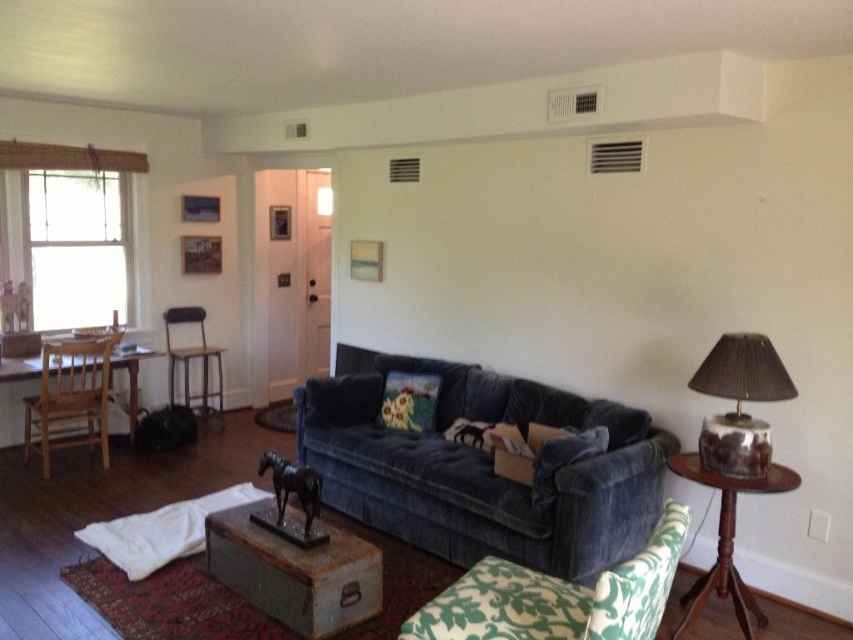
Question: Which point is closer to the camera taking this photo?

Choices:
 (A) (401, 374)
 (B) (660, 515)
 (C) (581, 445)

Answer: (B)

Question: Which object is farther from the camera taking this photo?

Choices:
 (A) green floral fabric armchair at lower right
 (B) wooden lamp at right
 (C) velvet blue couch at center
 (D) marble lampshade at right

Answer: (C)

Question: Can you confirm if velvet blue couch at center is positioned below velvet blue pillow at center?

Choices:
 (A) yes
 (B) no

Answer: (A)

Question: Estimate the real-world distances between objects in this image. Which object is farther from the green floral fabric armchair at lower right?

Choices:
 (A) velvet floral pillow at center
 (B) wooden chair at left

Answer: (B)

Question: Does velvet blue couch at center have a lesser width compared to metallic bar stool at center?

Choices:
 (A) yes
 (B) no

Answer: (B)

Question: Is metallic bar stool at center closer to the viewer compared to velvet blue pillow at center?

Choices:
 (A) yes
 (B) no

Answer: (B)